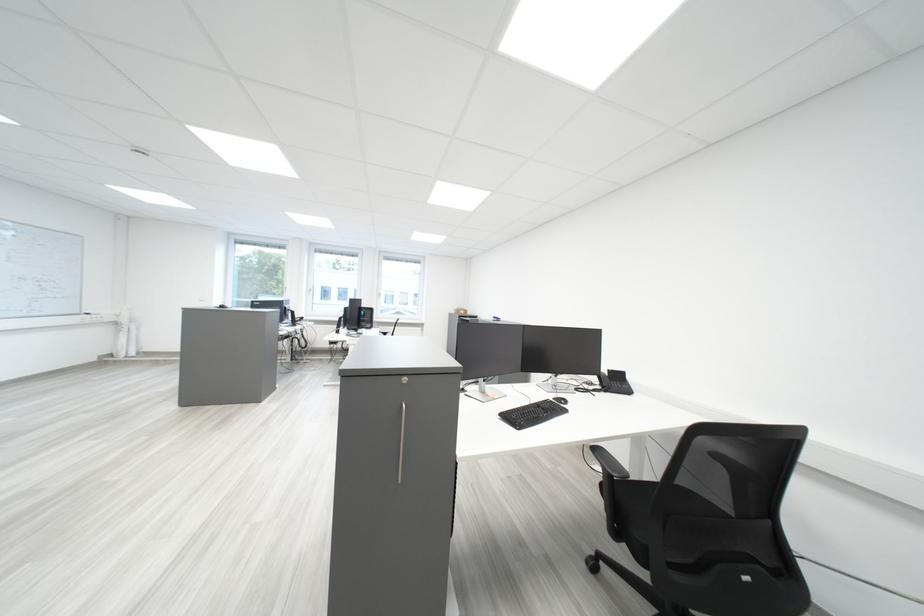
What do you see at coordinates (400, 442) in the screenshot? I see `the silver cabinet handle` at bounding box center [400, 442].